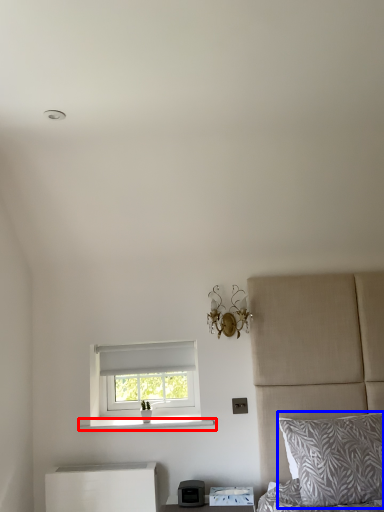
Question: Which of the following is the closest to the observer, window sill (highlighted by a red box) or pillow (highlighted by a blue box)?

Choices:
 (A) window sill
 (B) pillow

Answer: (B)